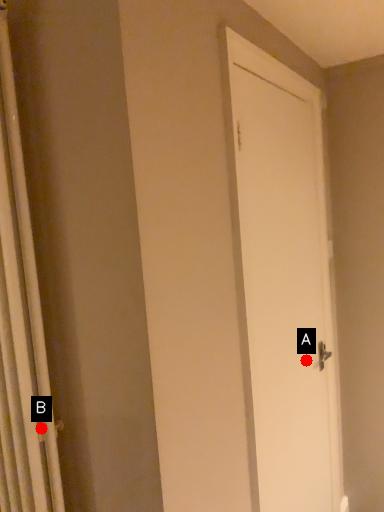
Question: Two points are circled on the image, labeled by A and B beside each circle. Which point is closer to the camera?

Choices:
 (A) A is closer
 (B) B is closer

Answer: (B)